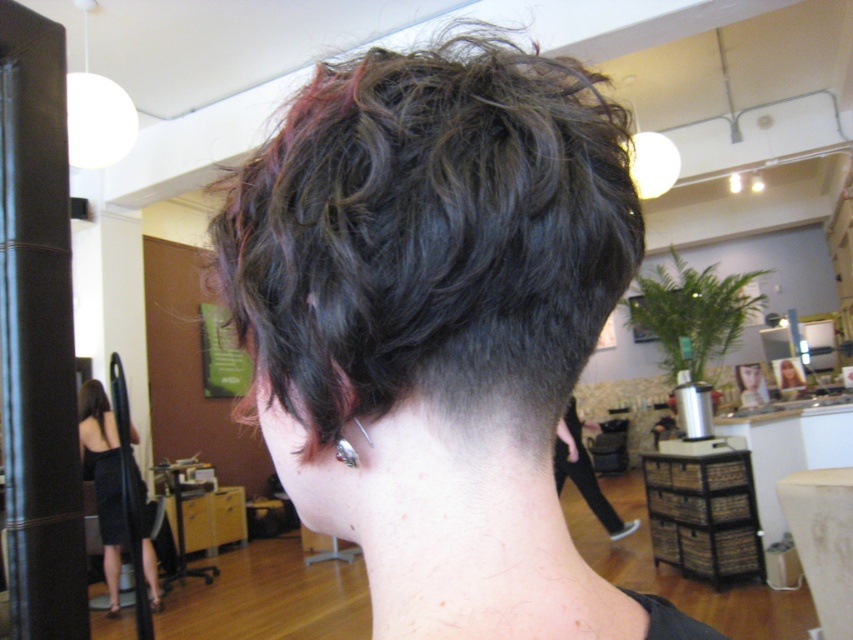
Can you confirm if black fabric barber at lower right is positioned to the left of silver metallic earring at back?

Incorrect, black fabric barber at lower right is not on the left side of silver metallic earring at back.

In the scene shown: Can you confirm if black fabric barber at lower right is wider than silver metallic earring at back?

Correct, the width of black fabric barber at lower right exceeds that of silver metallic earring at back.

Does point (566, 440) come farther from viewer compared to point (347, 458)?

Yes, point (566, 440) is behind point (347, 458).

Identify the location of black fabric barber at lower right. (584, 474).

Between black dress at left and silver metallic earring at back, which one has less height?

With less height is silver metallic earring at back.

Does black dress at left have a smaller size compared to silver metallic earring at back?

No.

Does point (112, 440) come in front of point (340, 451)?

No.

Identify the location of black dress at left. click(103, 480).

From the picture: Is dark wavy hair at center positioned before black dress at left?

Yes, it is.

Is dark wavy hair at center below black dress at left?

Incorrect, dark wavy hair at center is not positioned below black dress at left.

Identify the location of dark wavy hair at center. (430, 236).